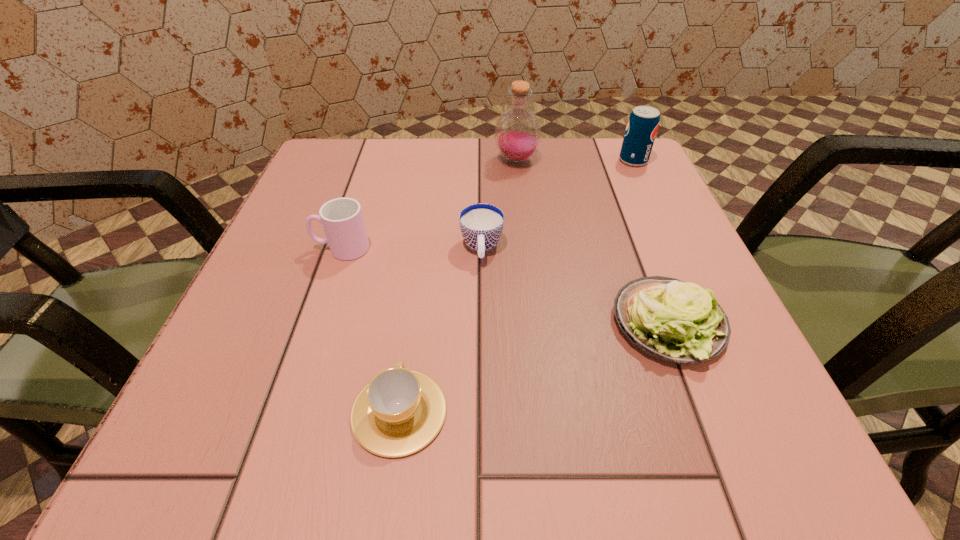
Locate an element on the screen. The width and height of the screenshot is (960, 540). vacant space located 0.060m with the handle on the side of the leftmost cup is located at coordinates (279, 248).

Where is `blank space located 0.070m with the handle on the side of the leftmost cup`? The image size is (960, 540). blank space located 0.070m with the handle on the side of the leftmost cup is located at coordinates (274, 248).

Find the location of a particular element. blank space located 0.160m on the side of the rightmost cup with the handle is located at coordinates (482, 348).

At what (x,y) coordinates should I click in order to perform the action: click on free spot located 0.250m on the left of the lettuce. Please return your answer as a coordinate pair (x, y). This screenshot has width=960, height=540. Looking at the image, I should click on (443, 323).

Identify the location of vacant space located with the handle on the side of the nearest cup. (413, 314).

At what (x,y) coordinates should I click in order to perform the action: click on free space located with the handle on the side of the nearest cup. Please return your answer as a coordinate pair (x, y). This screenshot has width=960, height=540. Looking at the image, I should click on (421, 252).

I want to click on vacant space located 0.190m with the handle on the side of the nearest cup, so click(419, 272).

You are a GUI agent. You are given a task and a screenshot of the screen. Output one action in this format:
    pyautogui.click(x=<x>, y=<y>)
    Task: Click on the bottle located in the far edge section of the desktop
    This screenshot has width=960, height=540.
    Given the screenshot: What is the action you would take?
    pyautogui.click(x=517, y=133)

Locate an element on the screen. This screenshot has height=540, width=960. pop present at the far edge is located at coordinates (643, 122).

At what (x,y) coordinates should I click in order to perform the action: click on object that is at the near edge. Please return your answer as a coordinate pair (x, y). Looking at the image, I should click on (399, 412).